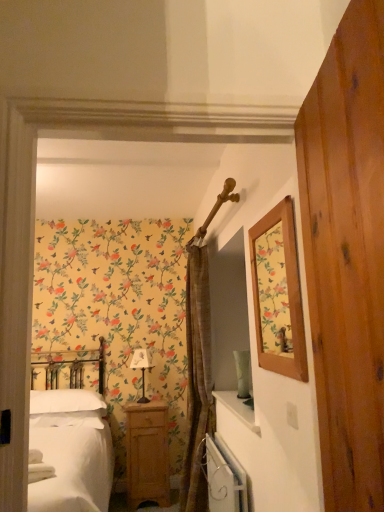
Question: Does point (145, 445) appear closer or farther from the camera than point (297, 312)?

Choices:
 (A) farther
 (B) closer

Answer: (A)

Question: Would you say light wood/texture nightstand at lower center is to the left or to the right of wooden picture frame at upper right in the picture?

Choices:
 (A) right
 (B) left

Answer: (B)

Question: Which object is the closest to the wooden picture frame at upper right?

Choices:
 (A) wooden barn door at right
 (B) white matte bed at left
 (C) white soft pillow at lower left
 (D) white metallic radiator at lower center
 (E) white fabric-covered lampshade at center

Answer: (A)

Question: Which object is the closest to the light wood/texture nightstand at lower center?

Choices:
 (A) white matte bed at left
 (B) wooden picture frame at upper right
 (C) white metallic radiator at lower center
 (D) brown textured curtain at center
 (E) white soft pillow at lower left

Answer: (A)